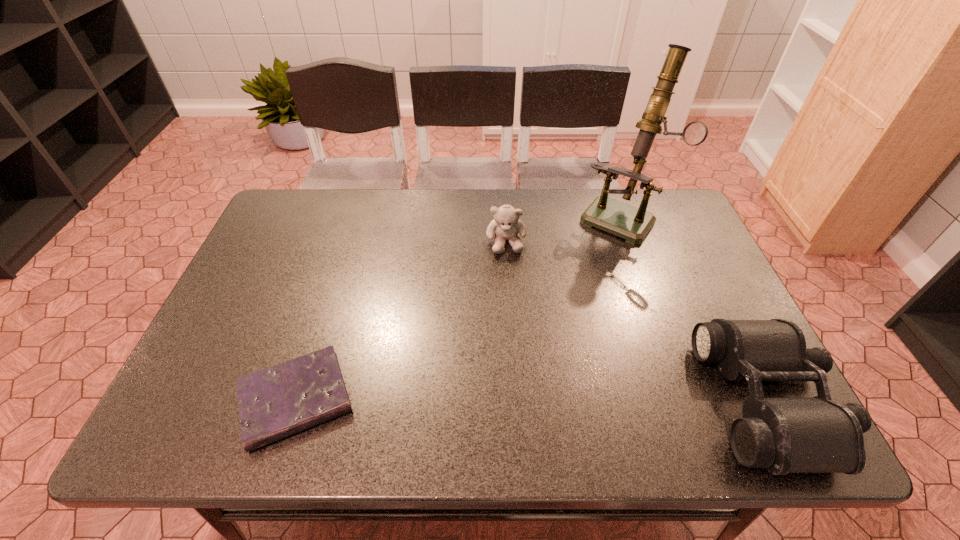
Find the location of a particular element. vacant spot on the desktop that is between the leftmost object and the third tallest object and is positioned on the face of the second tallest object is located at coordinates (517, 400).

Find the location of a particular element. free space on the desktop that is between the shortest object and the third tallest object and is positioned at the eyepiece of the tallest object is located at coordinates (484, 400).